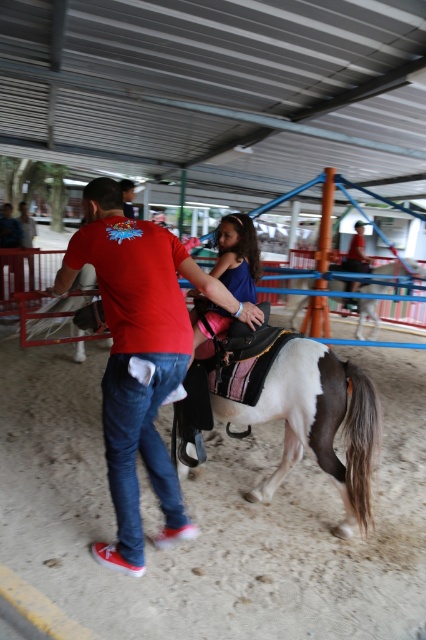
Can you confirm if brown sandy dirt track at center is wider than red cotton t-shirt at center?

Yes.

Who is more forward, (324, 488) or (137, 563)?

Point (137, 563) is in front.

Where is `brown sandy dirt track at center`? The width and height of the screenshot is (426, 640). brown sandy dirt track at center is located at coordinates (213, 516).

Who is more distant from viewer, (252, 294) or (394, 304)?

Point (394, 304)

Is point (244, 291) farther from camera compared to point (357, 326)?

No, it is not.

Describe the element at coordinates (236, 256) in the screenshot. I see `blue cotton shirt at center` at that location.

Where is `blue cotton shirt at center`? blue cotton shirt at center is located at coordinates (236, 256).

Who is more forward, (216, 458) or (388, 272)?

Positioned in front is point (216, 458).

The image size is (426, 640). Find the location of `brown sandy dirt track at center`. brown sandy dirt track at center is located at coordinates (213, 516).